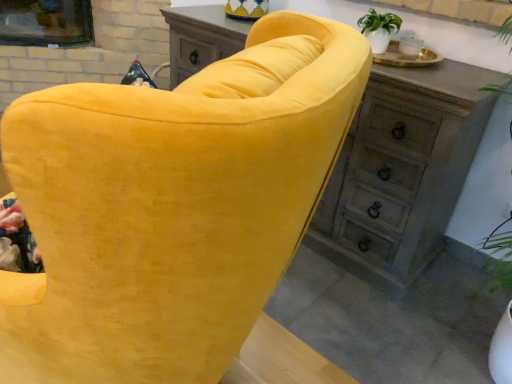
Question: Can you confirm if wooden chest of drawers at upper center is positioned to the right of wooden dresser at center?

Choices:
 (A) no
 (B) yes

Answer: (A)

Question: Is wooden dresser at center at the back of wooden chest of drawers at upper center?

Choices:
 (A) yes
 (B) no

Answer: (B)

Question: Is wooden chest of drawers at upper center located outside wooden dresser at center?

Choices:
 (A) yes
 (B) no

Answer: (A)

Question: From a real-world perspective, is wooden chest of drawers at upper center under wooden dresser at center?

Choices:
 (A) no
 (B) yes

Answer: (B)

Question: Is there a large distance between wooden chest of drawers at upper center and wooden dresser at center?

Choices:
 (A) no
 (B) yes

Answer: (A)

Question: Would you say wooden chest of drawers at upper center is to the left or to the right of velvet yellow sofa at center in the picture?

Choices:
 (A) right
 (B) left

Answer: (A)

Question: Would you say wooden chest of drawers at upper center is inside or outside velvet yellow sofa at center?

Choices:
 (A) outside
 (B) inside

Answer: (A)

Question: In terms of width, does wooden chest of drawers at upper center look wider or thinner when compared to velvet yellow sofa at center?

Choices:
 (A) thin
 (B) wide

Answer: (A)

Question: Relative to velvet yellow sofa at center, is wooden chest of drawers at upper center in front or behind?

Choices:
 (A) behind
 (B) front

Answer: (A)

Question: From a real-world perspective, is wooden chest of drawers at upper center positioned above or below wooden dresser at center?

Choices:
 (A) below
 (B) above

Answer: (A)

Question: Considering the positions of wooden chest of drawers at upper center and wooden dresser at center in the image, is wooden chest of drawers at upper center wider or thinner than wooden dresser at center?

Choices:
 (A) thin
 (B) wide

Answer: (A)

Question: Considering the positions of wooden chest of drawers at upper center and wooden dresser at center in the image, is wooden chest of drawers at upper center taller or shorter than wooden dresser at center?

Choices:
 (A) tall
 (B) short

Answer: (B)

Question: Do you think wooden chest of drawers at upper center is within wooden dresser at center, or outside of it?

Choices:
 (A) outside
 (B) inside

Answer: (A)

Question: Is point (373, 200) closer or farther from the camera than point (173, 23)?

Choices:
 (A) closer
 (B) farther

Answer: (A)

Question: From the image's perspective, is wooden dresser at center located above or below wooden chest of drawers at upper center?

Choices:
 (A) below
 (B) above

Answer: (A)